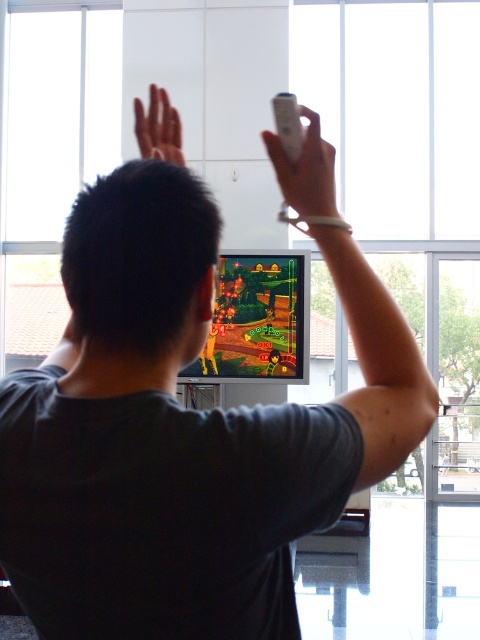
Question: Considering the relative positions of transparent glass window at upper center and white plastic remote at upper center in the image provided, where is transparent glass window at upper center located with respect to white plastic remote at upper center?

Choices:
 (A) above
 (B) below

Answer: (B)

Question: Among these points, which one is farthest from the camera?

Choices:
 (A) (163, 122)
 (B) (479, 467)
 (C) (288, 132)
 (D) (278, 147)

Answer: (B)

Question: Among these objects, which one is nearest to the camera?

Choices:
 (A) transparent glass window at upper center
 (B) smooth skin hand at upper center

Answer: (B)

Question: Does transparent glass window at upper center appear on the left side of white plastic remote at upper center?

Choices:
 (A) yes
 (B) no

Answer: (B)

Question: Which point appears farthest from the camera in this image?

Choices:
 (A) (282, 120)
 (B) (327, 179)
 (C) (454, 208)
 (D) (175, 113)

Answer: (C)

Question: Can you confirm if transparent glass window at upper center is smaller than smooth skin hand at upper center?

Choices:
 (A) yes
 (B) no

Answer: (A)